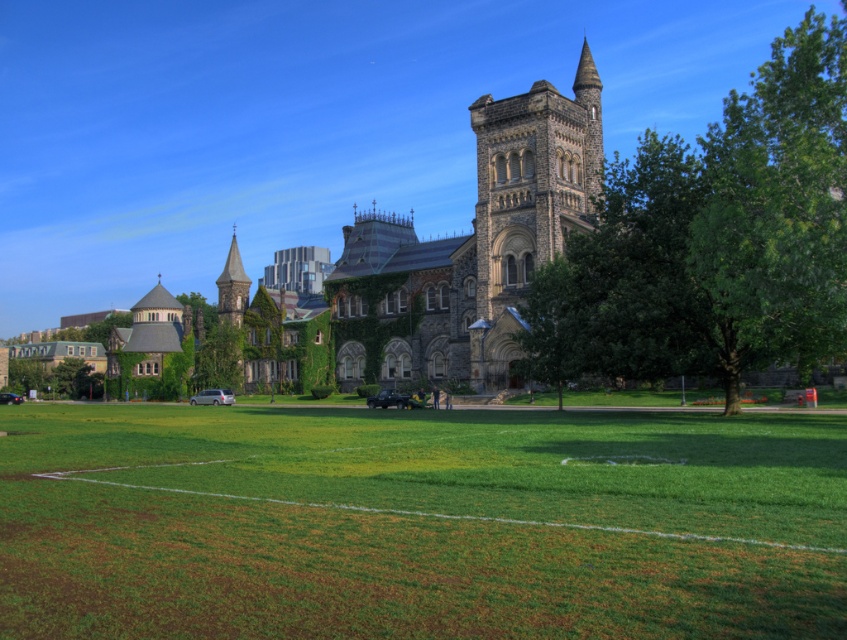
Question: Does green grass field at center have a greater width compared to stone church at center?

Choices:
 (A) yes
 (B) no

Answer: (B)

Question: Is green leafy tree at center-right thinner than stone church at center?

Choices:
 (A) yes
 (B) no

Answer: (A)

Question: Among these points, which one is farthest from the camera?

Choices:
 (A) (272, 288)
 (B) (280, 540)
 (C) (707, 346)

Answer: (A)

Question: Which object appears closest to the camera in this image?

Choices:
 (A) green grass field at center
 (B) stone church at center

Answer: (A)

Question: Does green grass field at center have a smaller size compared to stone church at center?

Choices:
 (A) no
 (B) yes

Answer: (B)

Question: Which point appears closest to the camera in this image?

Choices:
 (A) (475, 321)
 (B) (840, 188)

Answer: (B)